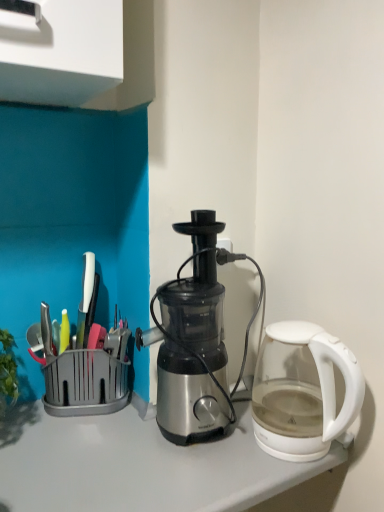
Question: Considering the relative sizes of transparent glass kettle at right and metallic silver juicer at center in the image provided, is transparent glass kettle at right smaller than metallic silver juicer at center?

Choices:
 (A) no
 (B) yes

Answer: (B)

Question: Is transparent glass kettle at right at the left side of metallic silver juicer at center?

Choices:
 (A) no
 (B) yes

Answer: (A)

Question: Is transparent glass kettle at right thinner than metallic silver juicer at center?

Choices:
 (A) yes
 (B) no

Answer: (B)

Question: Is transparent glass kettle at right positioned behind metallic silver juicer at center?

Choices:
 (A) no
 (B) yes

Answer: (A)

Question: From a real-world perspective, is transparent glass kettle at right located higher than metallic silver juicer at center?

Choices:
 (A) no
 (B) yes

Answer: (A)

Question: Is transparent glass kettle at right wider than metallic silver juicer at center?

Choices:
 (A) no
 (B) yes

Answer: (B)

Question: Considering the relative sizes of metallic silver juicer at center and transparent glass kettle at right in the image provided, is metallic silver juicer at center wider than transparent glass kettle at right?

Choices:
 (A) yes
 (B) no

Answer: (B)

Question: Does metallic silver juicer at center appear on the left side of transparent glass kettle at right?

Choices:
 (A) no
 (B) yes

Answer: (B)

Question: Is metallic silver juicer at center oriented towards transparent glass kettle at right?

Choices:
 (A) yes
 (B) no

Answer: (B)

Question: Is metallic silver juicer at center to the right of transparent glass kettle at right from the viewer's perspective?

Choices:
 (A) no
 (B) yes

Answer: (A)

Question: Would you say metallic silver juicer at center is a long distance from transparent glass kettle at right?

Choices:
 (A) yes
 (B) no

Answer: (B)

Question: Is metallic silver juicer at center behind transparent glass kettle at right?

Choices:
 (A) yes
 (B) no

Answer: (A)

Question: In the image, is metallic silver juicer at center positioned in front of or behind transparent glass kettle at right?

Choices:
 (A) front
 (B) behind

Answer: (B)